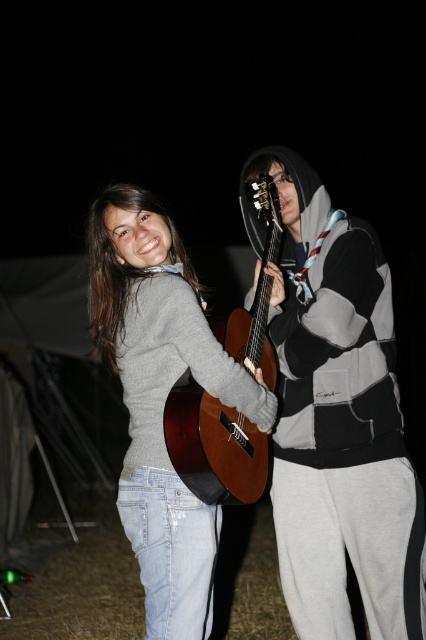
Question: Estimate the real-world distances between objects in this image. Which object is farther from the matte black hoodie at center?

Choices:
 (A) matte gray sweater at center
 (B) wooden acoustic guitar at center

Answer: (A)

Question: Is matte black hoodie at center in front of matte gray sweater at center?

Choices:
 (A) no
 (B) yes

Answer: (A)

Question: Which point is farther from the camera taking this photo?

Choices:
 (A) (132, 508)
 (B) (264, 188)

Answer: (B)

Question: Based on their relative distances, which object is nearer to the matte gray sweater at left?

Choices:
 (A) matte gray sweater at center
 (B) matte black hoodie at center

Answer: (A)

Question: Does matte black hoodie at center have a lesser width compared to matte gray sweater at center?

Choices:
 (A) yes
 (B) no

Answer: (A)

Question: Is matte gray sweater at center smaller than matte gray sweater at left?

Choices:
 (A) no
 (B) yes

Answer: (A)